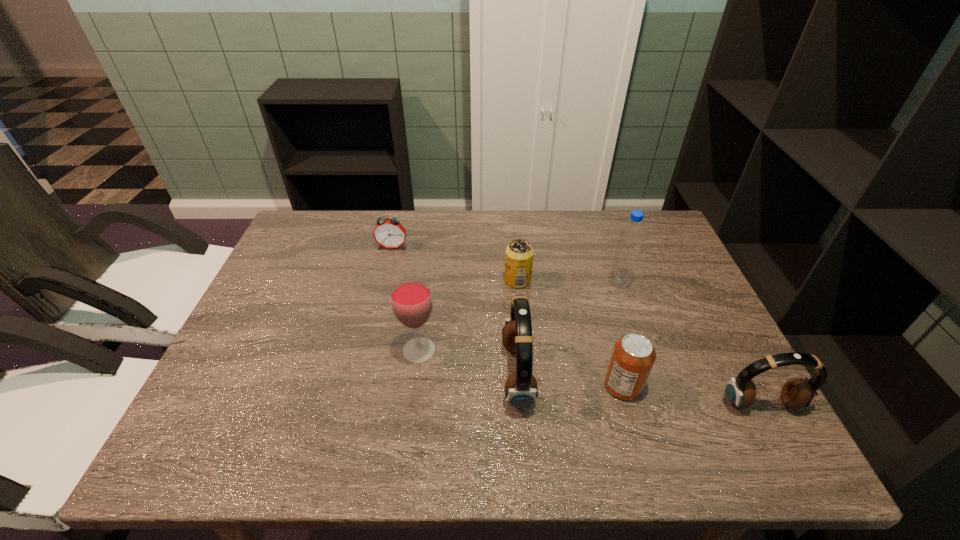
Locate an element on the screen. This screenshot has height=540, width=960. vacant space at the left edge of the desktop is located at coordinates (271, 334).

In the image, there is a desktop. Where is `free region at the right edge`? This screenshot has height=540, width=960. free region at the right edge is located at coordinates (675, 293).

At what (x,y) coordinates should I click in order to perform the action: click on free region at the far left corner. Please return your answer as a coordinate pair (x, y). Image resolution: width=960 pixels, height=540 pixels. Looking at the image, I should click on (321, 242).

I want to click on vacant space at the near right corner of the desktop, so click(698, 383).

Identify the location of blank region between the alarm clock and the shorter headset. (577, 326).

At what (x,y) coordinates should I click in order to perform the action: click on unoccupied area between the right headset and the farthest object. Please return your answer as a coordinate pair (x, y). The height and width of the screenshot is (540, 960). Looking at the image, I should click on (577, 326).

Locate an element on the screen. vacant region between the beer can and the can is located at coordinates (570, 333).

Locate an element on the screen. This screenshot has height=540, width=960. empty space that is in between the can and the beer can is located at coordinates (570, 333).

You are a GUI agent. You are given a task and a screenshot of the screen. Output one action in this format:
    pyautogui.click(x=<x>, y=<y>)
    Task: Click on the unoccupied position between the taller headset and the water bottle
    The width and height of the screenshot is (960, 540).
    Given the screenshot: What is the action you would take?
    pyautogui.click(x=568, y=329)

The image size is (960, 540). Identify the location of free space between the wineglass and the fourth tallest object. (590, 377).